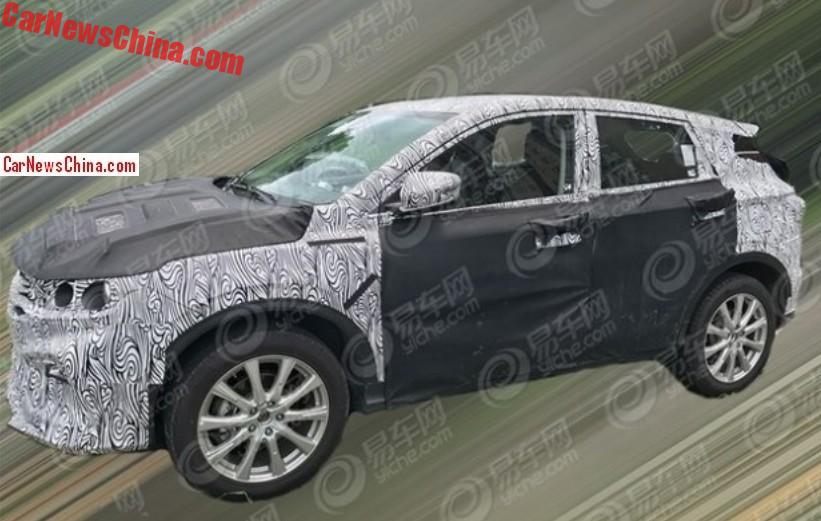
The image size is (821, 521). I want to click on door handles, so click(563, 226), click(703, 210).